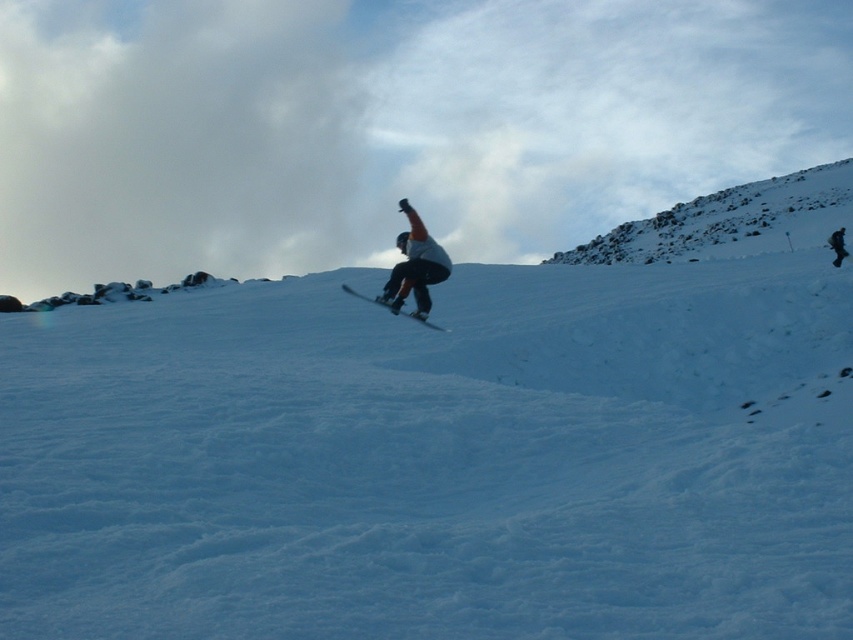
Consider the image. You are a photographer planning to capture the snowy rocky hill at upper right and the matte black snowboard at center in a single shot. Which object should you focus on first to ensure both are in frame?

The snowy rocky hill at upper right is taller than the matte black snowboard at center, so focusing on the snowy rocky hill at upper right first will help ensure both objects are within the frame.

Consider the image. You are planning to build a snowman using the white powdery snow at center and the snowy rocky hill at upper right. Which object would provide enough material for the base of the snowman?

The white powdery snow at center is larger in size than the snowy rocky hill at upper right, so it would provide enough material for the base of the snowman.

You are a photographer trying to capture the snowboarder in the midground against the snow in the center. Which object, the white powdery snow at center or the matte black snowboard at center, should you focus on to ensure the snowboarder stands out clearly?

The white powdery snow at center is positioned over matte black snowboard at center. To ensure the snowboarder stands out clearly, focus on the matte black snowboard at center as the background, since the dark background will contrast with the light colors of the snowboarder.